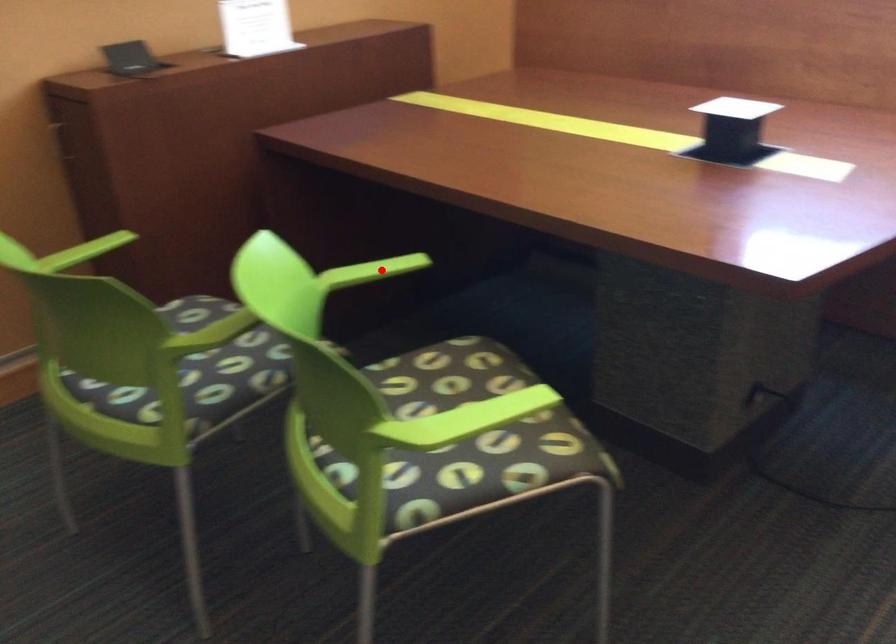
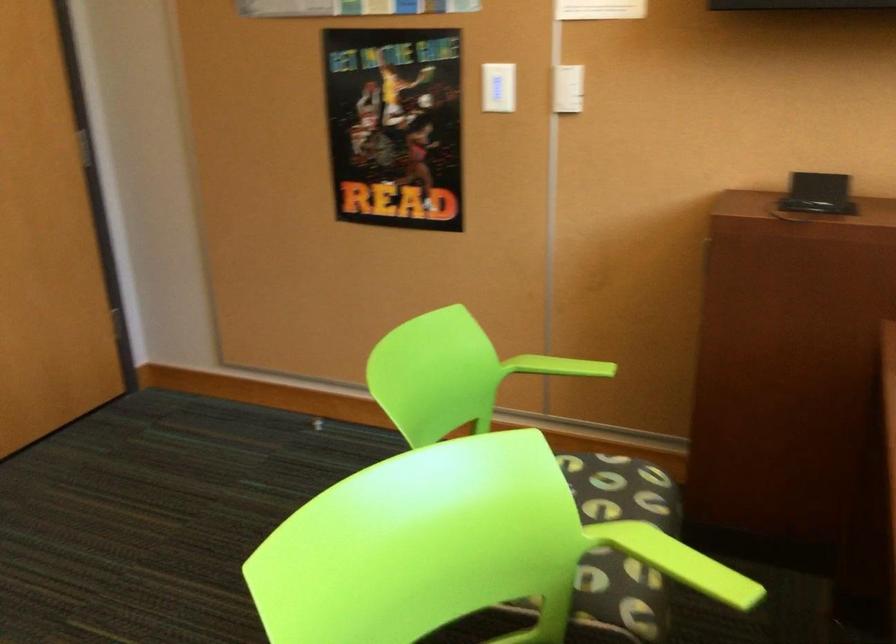
Locate, in the second image, the point that corresponds to the highlighted location in the first image.

(685, 564)